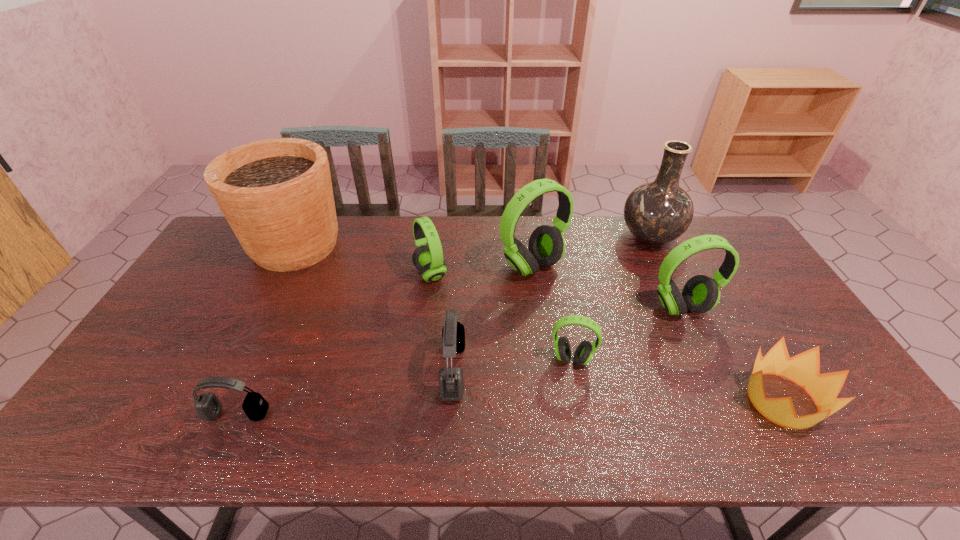
Choose which green headset is the nearest neighbor to the nearest green headset. Please provide its 2D coordinates. Your answer should be formatted as a tuple, i.e. [(x, y)], where the tuple contains the x and y coordinates of a point satisfying the conditions above.

[(700, 294)]

Identify the location of free spot that satisfies the following two spatial constraints: 1. on the front side of the biggest green headset; 2. on the right side of the nearest green headset. 545,359.

Where is `free space in the image that satisfies the following two spatial constraints: 1. on the front side of the tallest headset; 2. on the right side of the flowerpot`? The image size is (960, 540). free space in the image that satisfies the following two spatial constraints: 1. on the front side of the tallest headset; 2. on the right side of the flowerpot is located at coordinates (285, 266).